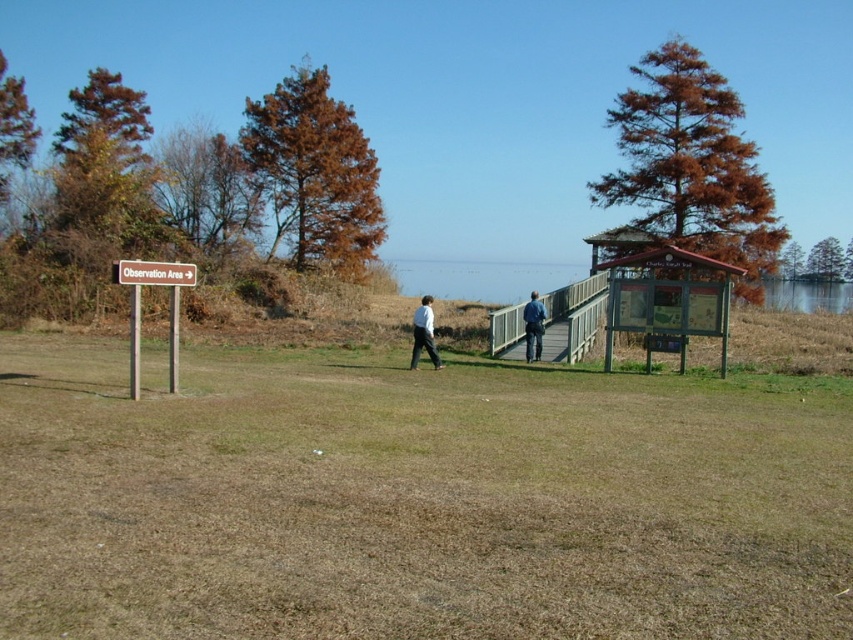
Question: Which object appears farthest from the camera in this image?

Choices:
 (A) brown wooden sign at left
 (B) brown dry grass at center
 (C) white matte shirt at center

Answer: (C)

Question: Can you confirm if brown wooden sign at left is thinner than blue denim jeans at center?

Choices:
 (A) no
 (B) yes

Answer: (A)

Question: Which object is positioned closest to the blue denim jeans at center?

Choices:
 (A) brown wooden sign at left
 (B) white matte shirt at center

Answer: (B)

Question: Which point is closer to the camera?

Choices:
 (A) white matte shirt at center
 (B) red wooden sign at upper left

Answer: (B)

Question: Can you confirm if red wooden sign at upper left is positioned to the right of blue denim jeans at center?

Choices:
 (A) no
 (B) yes

Answer: (A)

Question: Does brown wooden sign at left have a greater width compared to blue denim jeans at center?

Choices:
 (A) no
 (B) yes

Answer: (B)